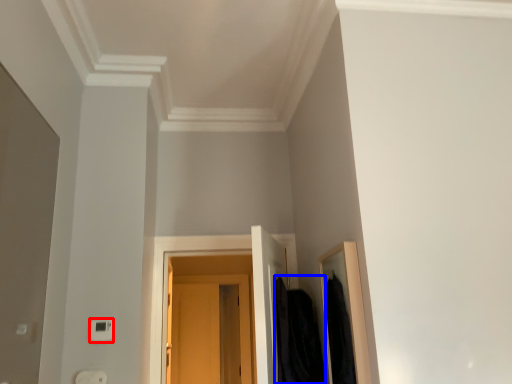
Question: Among these objects, which one is nearest to the camera, light switch (highlighted by a red box) or clothing (highlighted by a blue box)?

Choices:
 (A) light switch
 (B) clothing

Answer: (B)